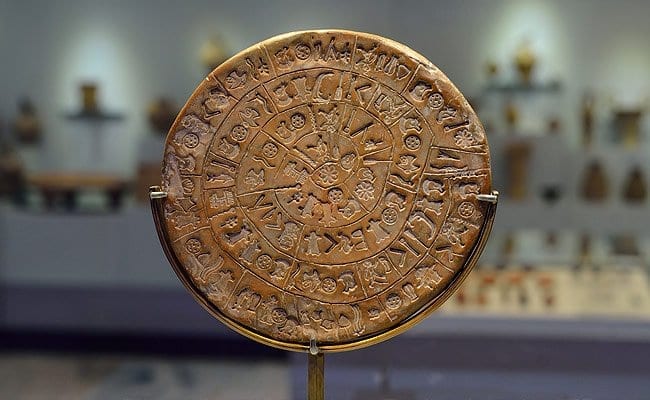
Find the location of a particular element. This screenshot has height=400, width=650. metal stand is located at coordinates (318, 381).